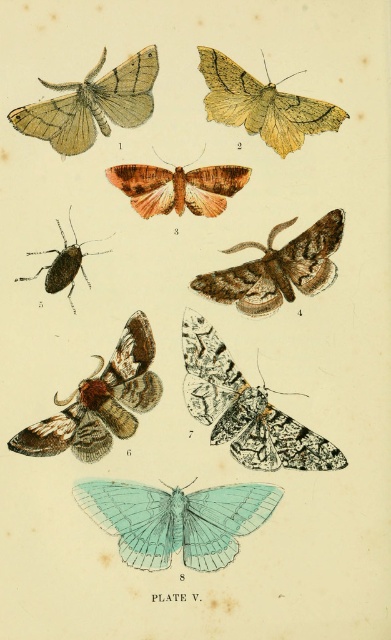
You are an entomologist examining the image of moths. You need to identify which of the two moths, the black and white speckled moth at center or the matte black bug at left, is larger in size. Which one should you report as the larger one?

The black and white speckled moth at center is bigger than the matte black bug at left, so you should report the black and white speckled moth at center as the larger one.

You are an entomologist examining the moth illustrations. You notice the matte brown moth at upper left and the brown textured moth at center. Which of these two moths has a greater height?

The matte brown moth at upper left is taller than the brown textured moth at center.